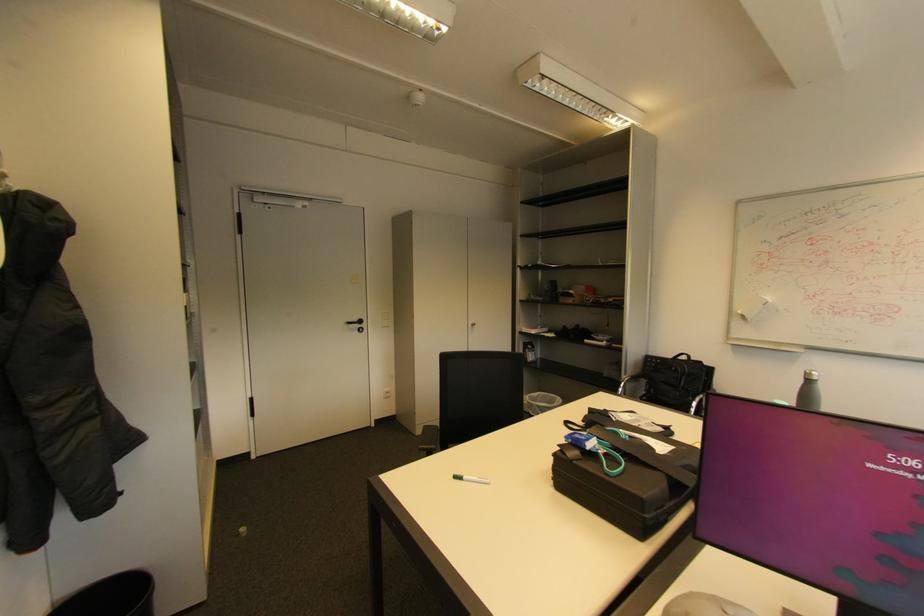
You are a GUI agent. You are given a task and a screenshot of the screen. Output one action in this format:
    pyautogui.click(x=<x>, y=<y>)
    Task: Click on the chair armrest
    The height and width of the screenshot is (616, 924).
    Given the screenshot: What is the action you would take?
    pyautogui.click(x=429, y=438)